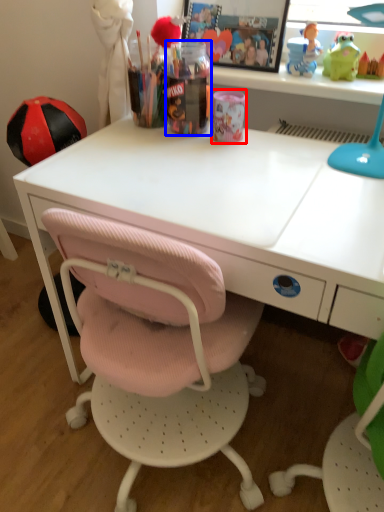
Question: Among these objects, which one is farthest to the camera, stationery (highlighted by a red box) or stationery (highlighted by a blue box)?

Choices:
 (A) stationery
 (B) stationery

Answer: (A)